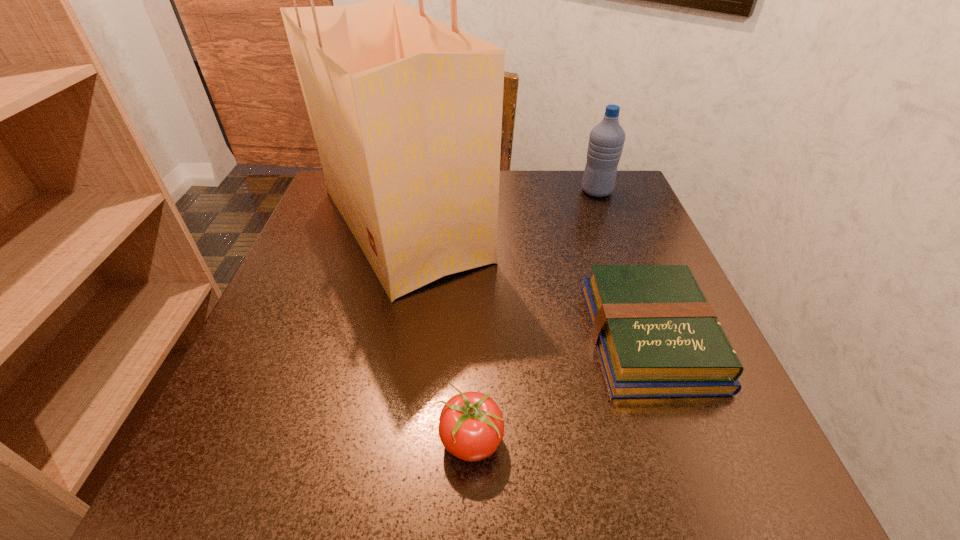
Find the location of `water bottle at the far edge`. water bottle at the far edge is located at coordinates (606, 141).

Find the location of a particular element. object that is at the near edge is located at coordinates (471, 426).

You are a GUI agent. You are given a task and a screenshot of the screen. Output one action in this format:
    pyautogui.click(x=<x>, y=<y>)
    Task: Click on the object located at the left edge
    The image size is (960, 540).
    Given the screenshot: What is the action you would take?
    pyautogui.click(x=406, y=111)

Identify the location of water bottle that is positioned at the right edge. The height and width of the screenshot is (540, 960). (606, 141).

Identify the location of book present at the right edge. The width and height of the screenshot is (960, 540). (657, 336).

This screenshot has height=540, width=960. In order to click on object that is at the far left corner in this screenshot , I will do `click(406, 111)`.

Where is `object that is positioned at the far right corner`? This screenshot has height=540, width=960. object that is positioned at the far right corner is located at coordinates tap(606, 141).

I want to click on vacant space at the far edge, so click(512, 181).

The image size is (960, 540). In the image, there is a desktop. In order to click on vacant region at the near edge in this screenshot , I will do `click(545, 486)`.

Locate an element on the screen. free space at the left edge of the desktop is located at coordinates (350, 263).